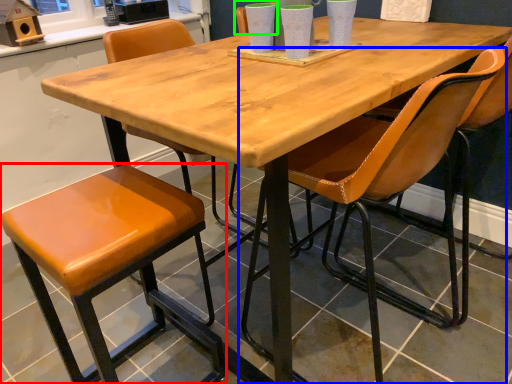
Question: Estimate the real-world distances between objects in this image. Which object is closer to stool (highlighted by a red box), chair (highlighted by a blue box) or chair (highlighted by a green box)?

Choices:
 (A) chair
 (B) chair

Answer: (A)